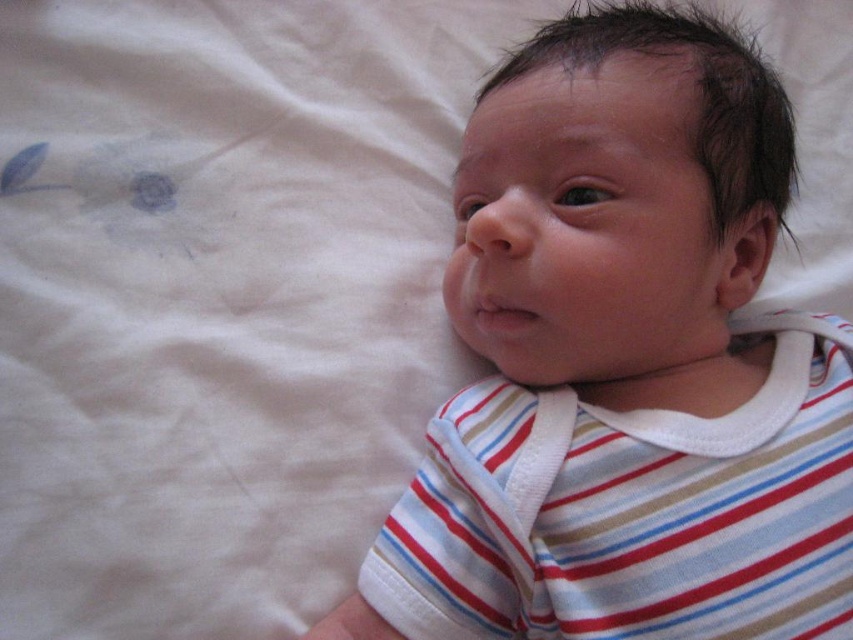
Does white striped shirt at center have a smaller size compared to striped cotton shirt at center?

No, white striped shirt at center is not smaller than striped cotton shirt at center.

Is point (503, 250) more distant than point (827, 397)?

No, (503, 250) is closer to viewer.

I want to click on white striped shirt at center, so click(624, 364).